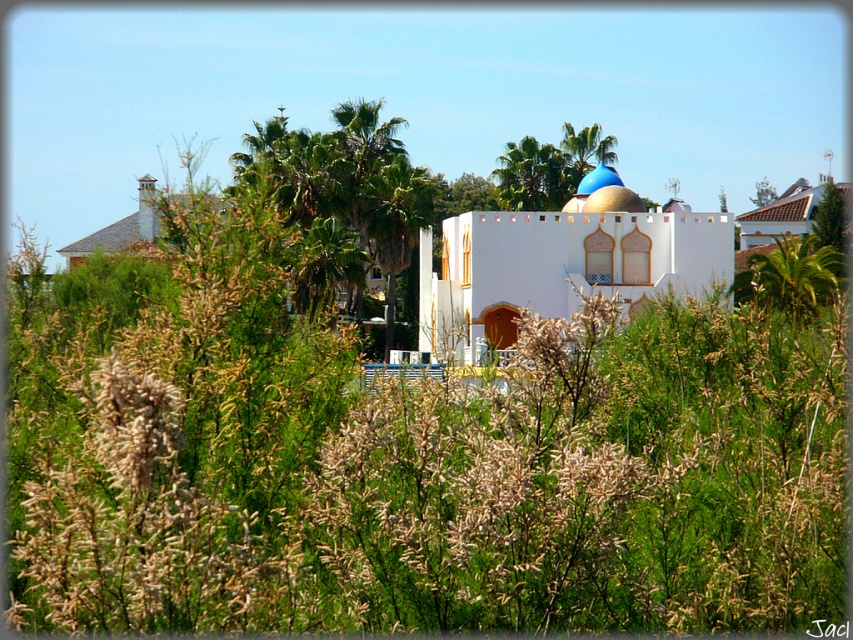
Question: Which point is farther from the camera taking this photo?

Choices:
 (A) (553, 246)
 (B) (595, 172)
 (C) (553, 202)

Answer: (C)

Question: Among these points, which one is nearest to the camera?

Choices:
 (A) (587, 193)
 (B) (508, 196)
 (C) (602, 182)

Answer: (C)

Question: Is white matte building at center smaller than blue glossy dome at upper center?

Choices:
 (A) no
 (B) yes

Answer: (A)

Question: Which of the following is the farthest from the observer?

Choices:
 (A) (701, 282)
 (B) (517, 160)

Answer: (B)

Question: Does green leafy palm tree at upper center appear under blue glossy dome at upper center?

Choices:
 (A) no
 (B) yes

Answer: (A)

Question: Is green leafy palm tree at upper center bigger than blue glossy dome at upper center?

Choices:
 (A) yes
 (B) no

Answer: (B)